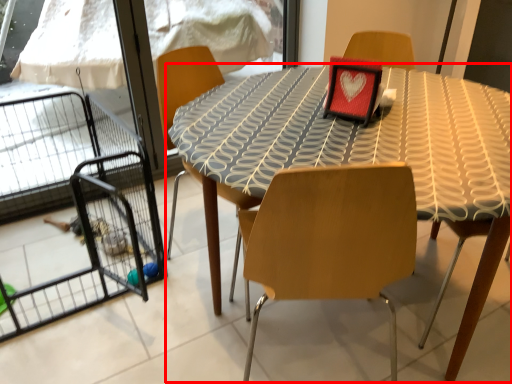
Question: From the image's perspective, what is the correct spatial relationship of table (annotated by the red box) in relation to cage?

Choices:
 (A) below
 (B) above

Answer: (B)